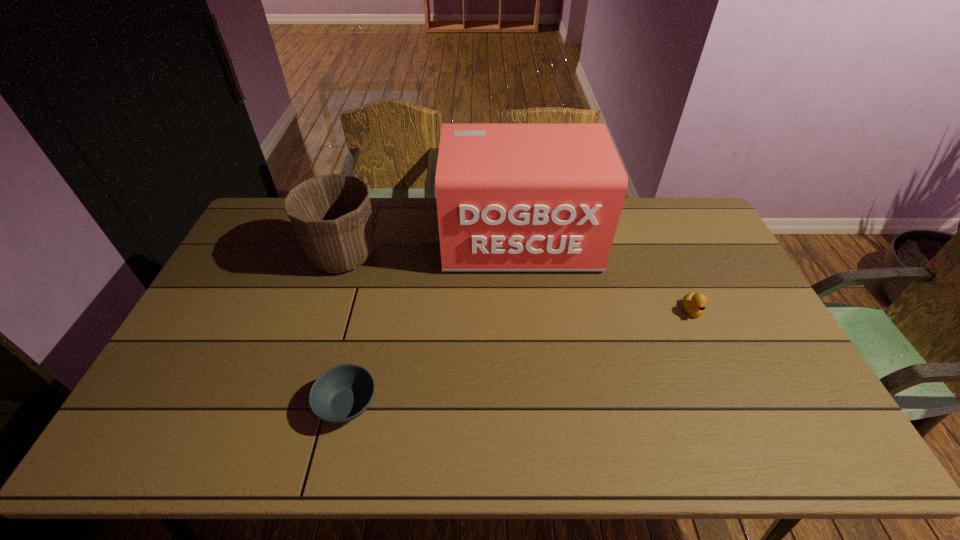
Locate an element on the screen. The width and height of the screenshot is (960, 540). the closest object to the soup bowl is located at coordinates (331, 214).